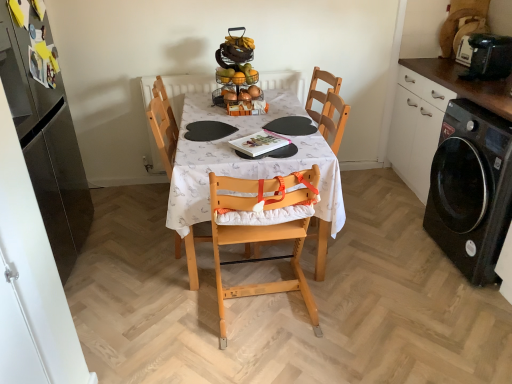
Where is `light wood highchair at center, which is the 1th chair in left-to-right order`? This screenshot has width=512, height=384. light wood highchair at center, which is the 1th chair in left-to-right order is located at coordinates (163, 130).

At what (x,y) coordinates should I click in order to perform the action: click on glossy stainless steel refrigerator at left, the 1th cabinetry viewed from the left. Please return your answer as a coordinate pair (x, y). Looking at the image, I should click on (46, 146).

This screenshot has height=384, width=512. Describe the element at coordinates (431, 115) in the screenshot. I see `black matte cabinet at right, which is counted as the 2th cabinetry, starting from the left` at that location.

What is the approximate height of black glossy washing machine at right?

black glossy washing machine at right is 33.84 inches tall.

What are the coordinates of `black plastic toaster at upper right` in the screenshot? It's located at (488, 56).

Considering the sizes of black matte cabinet at right, which is counted as the 2th cabinetry, starting from the left, and light wood highchair at center, which is the 1th chair in left-to-right order, in the image, is black matte cabinet at right, which is counted as the 2th cabinetry, starting from the left, taller or shorter than light wood highchair at center, which is the 1th chair in left-to-right order,?

Considering their sizes, black matte cabinet at right, which is counted as the 2th cabinetry, starting from the left, has less height than light wood highchair at center, which is the 1th chair in left-to-right order.

In terms of size, does black matte cabinet at right, which is counted as the 2th cabinetry, starting from the left, appear bigger or smaller than light wood highchair at center, which is counted as the 2th chair, starting from the right?

Considering their sizes, black matte cabinet at right, which is counted as the 2th cabinetry, starting from the left, takes up more space than light wood highchair at center, which is counted as the 2th chair, starting from the right.

Identify the location of kitchen appliance in front of the black plastic toaster at upper right. (471, 189).

Between black glossy washing machine at right and black plastic toaster at upper right, which one appears on the left side from the viewer's perspective?

black plastic toaster at upper right is more to the left.

Would you say black glossy washing machine at right is outside black plastic toaster at upper right?

Yes, black glossy washing machine at right is not within black plastic toaster at upper right.

Does black glossy washing machine at right have a lesser width compared to black plastic toaster at upper right?

In fact, black glossy washing machine at right might be wider than black plastic toaster at upper right.

Does light wood highchair at center, which is counted as the 2th chair, starting from the right, have a larger size compared to glossy stainless steel refrigerator at left, the 1th cabinetry viewed from the left?

Incorrect, light wood highchair at center, which is counted as the 2th chair, starting from the right, is not larger than glossy stainless steel refrigerator at left, the 1th cabinetry viewed from the left.

From a real-world perspective, between light wood highchair at center, which is counted as the 2th chair, starting from the right, and glossy stainless steel refrigerator at left, the 1th cabinetry viewed from the left, who is vertically higher?

glossy stainless steel refrigerator at left, the 1th cabinetry viewed from the left.

Considering the relative sizes of light wood highchair at center, which is counted as the 2th chair, starting from the right, and glossy stainless steel refrigerator at left, which appears as the second cabinetry when viewed from the right, in the image provided, is light wood highchair at center, which is counted as the 2th chair, starting from the right, shorter than glossy stainless steel refrigerator at left, which appears as the second cabinetry when viewed from the right,?

Yes, light wood highchair at center, which is counted as the 2th chair, starting from the right, is shorter than glossy stainless steel refrigerator at left, which appears as the second cabinetry when viewed from the right.

Where is `the 2nd cabinetry positioned above the light wood highchair at center, which is counted as the 2th chair, starting from the right (from the image's perspective)`? the 2nd cabinetry positioned above the light wood highchair at center, which is counted as the 2th chair, starting from the right (from the image's perspective) is located at coordinates (46, 146).

From the image's perspective, is glossy stainless steel refrigerator at left, which appears as the second cabinetry when viewed from the right, located above or below light wood highchair at center, which is the 1th chair in left-to-right order?

From the image's perspective, glossy stainless steel refrigerator at left, which appears as the second cabinetry when viewed from the right, appears above light wood highchair at center, which is the 1th chair in left-to-right order.

What's the angular difference between glossy stainless steel refrigerator at left, which appears as the second cabinetry when viewed from the right, and light wood highchair at center, which is the 1th chair in left-to-right order,'s facing directions?

6.94e-06 degrees.

From a real-world perspective, relative to light wood highchair at center, which is counted as the 2th chair, starting from the right, is glossy stainless steel refrigerator at left, which appears as the second cabinetry when viewed from the right, vertically above or below?

glossy stainless steel refrigerator at left, which appears as the second cabinetry when viewed from the right, is situated higher than light wood highchair at center, which is counted as the 2th chair, starting from the right, in the real world.

Is glossy stainless steel refrigerator at left, the 1th cabinetry viewed from the left, not near light wood highchair at center, which is counted as the 2th chair, starting from the right?

Actually, glossy stainless steel refrigerator at left, the 1th cabinetry viewed from the left, and light wood highchair at center, which is counted as the 2th chair, starting from the right, are a little close together.

Considering the sizes of objects black glossy washing machine at right and glossy stainless steel refrigerator at left, the 1th cabinetry viewed from the left, in the image provided, who is taller, black glossy washing machine at right or glossy stainless steel refrigerator at left, the 1th cabinetry viewed from the left,?

With more height is glossy stainless steel refrigerator at left, the 1th cabinetry viewed from the left.

How much distance is there between black glossy washing machine at right and glossy stainless steel refrigerator at left, which appears as the second cabinetry when viewed from the right?

The distance of black glossy washing machine at right from glossy stainless steel refrigerator at left, which appears as the second cabinetry when viewed from the right, is 7.47 feet.

Is black glossy washing machine at right inside the boundaries of glossy stainless steel refrigerator at left, which appears as the second cabinetry when viewed from the right, or outside?

black glossy washing machine at right cannot be found inside glossy stainless steel refrigerator at left, which appears as the second cabinetry when viewed from the right.

Considering the sizes of objects black glossy washing machine at right and glossy stainless steel refrigerator at left, which appears as the second cabinetry when viewed from the right, in the image provided, who is thinner, black glossy washing machine at right or glossy stainless steel refrigerator at left, which appears as the second cabinetry when viewed from the right,?

glossy stainless steel refrigerator at left, which appears as the second cabinetry when viewed from the right.

Consider the image. From a real-world perspective, which is physically below, light wood highchair at center, the first chair viewed from the right, or black matte cabinet at right, the first cabinetry from the right?

From a 3D spatial view, light wood highchair at center, the first chair viewed from the right, is below.

Does light wood highchair at center, the first chair viewed from the right, appear on the left side of black matte cabinet at right, the first cabinetry from the right?

Yes.

Is light wood highchair at center, which is the 2th chair in left-to-right order, in front of or behind black matte cabinet at right, which is counted as the 2th cabinetry, starting from the left, in the image?

light wood highchair at center, which is the 2th chair in left-to-right order, is positioned farther from the viewer than black matte cabinet at right, which is counted as the 2th cabinetry, starting from the left.

Is light wood highchair at center, the first chair viewed from the right, smaller than black matte cabinet at right, the first cabinetry from the right?

Correct, light wood highchair at center, the first chair viewed from the right, occupies less space than black matte cabinet at right, the first cabinetry from the right.

Consider the image. From the image's perspective, is white fabric table at center below light wood highchair at center, which is the 2th chair in left-to-right order?

No.

Can you tell me how much white fabric table at center and light wood highchair at center, the first chair viewed from the right, differ in facing direction?

The facing directions of white fabric table at center and light wood highchair at center, the first chair viewed from the right, are 180 degrees apart.

Considering the sizes of white fabric table at center and light wood highchair at center, which is the 2th chair in left-to-right order, in the image, is white fabric table at center wider or thinner than light wood highchair at center, which is the 2th chair in left-to-right order,?

Considering their sizes, white fabric table at center looks broader than light wood highchair at center, which is the 2th chair in left-to-right order.

Does white fabric table at center have a greater height compared to light wood highchair at center, the first chair viewed from the right?

Incorrect, the height of white fabric table at center is not larger of that of light wood highchair at center, the first chair viewed from the right.

This screenshot has width=512, height=384. What are the coordinates of `cabinetry lying on the right of light wood highchair at center, which is counted as the 2th chair, starting from the right` in the screenshot? It's located at (431, 115).

Identify the location of appliance above the black glossy washing machine at right (from the image's perspective). click(488, 56).

From the image, which object appears to be farther from black matte cabinet at right, which is counted as the 2th cabinetry, starting from the left, glossy stainless steel refrigerator at left, the 1th cabinetry viewed from the left, or black glossy washing machine at right?

glossy stainless steel refrigerator at left, the 1th cabinetry viewed from the left, is positioned further to the anchor black matte cabinet at right, which is counted as the 2th cabinetry, starting from the left.

Estimate the real-world distances between objects in this image. Which object is closer to black matte cabinet at right, the first cabinetry from the right, black plastic toaster at upper right or light wood highchair at center, which is counted as the 2th chair, starting from the right?

black plastic toaster at upper right.

Considering their positions, is white fabric table at center positioned further to black matte cabinet at right, the first cabinetry from the right, than glossy stainless steel refrigerator at left, the 1th cabinetry viewed from the left?

glossy stainless steel refrigerator at left, the 1th cabinetry viewed from the left.

Based on their spatial positions, is light wood highchair at center, which is the 2th chair in left-to-right order, or glossy stainless steel refrigerator at left, the 1th cabinetry viewed from the left, closer to light wood highchair at center, which is counted as the 2th chair, starting from the right?

light wood highchair at center, which is the 2th chair in left-to-right order, is positioned closer to the anchor light wood highchair at center, which is counted as the 2th chair, starting from the right.

Considering their positions, is light wood highchair at center, which is counted as the 2th chair, starting from the right, positioned further to white fabric table at center than black plastic toaster at upper right?

The object further to white fabric table at center is black plastic toaster at upper right.

Considering their positions, is glossy stainless steel refrigerator at left, which appears as the second cabinetry when viewed from the right, positioned closer to black glossy washing machine at right than white fabric table at center?

The object closer to black glossy washing machine at right is white fabric table at center.

Looking at the image, which one is located closer to black matte cabinet at right, which is counted as the 2th cabinetry, starting from the left, light wood highchair at center, the first chair viewed from the right, or black plastic toaster at upper right?

Among the two, black plastic toaster at upper right is located nearer to black matte cabinet at right, which is counted as the 2th cabinetry, starting from the left.

When comparing their distances from glossy stainless steel refrigerator at left, the 1th cabinetry viewed from the left, does light wood highchair at center, which is the 1th chair in left-to-right order, or white fabric table at center seem closer?

light wood highchair at center, which is the 1th chair in left-to-right order, is closer to glossy stainless steel refrigerator at left, the 1th cabinetry viewed from the left.

What are the coordinates of `chair situated between light wood highchair at center, which is counted as the 2th chair, starting from the right, and black plastic toaster at upper right from left to right` in the screenshot? It's located at (263, 232).

This screenshot has height=384, width=512. In order to click on chair located between glossy stainless steel refrigerator at left, the 1th cabinetry viewed from the left, and white fabric table at center in the left-right direction in this screenshot , I will do `click(163, 130)`.

Identify the location of chair situated between light wood highchair at center, which is counted as the 2th chair, starting from the right, and black glossy washing machine at right from left to right. (263, 232).

Image resolution: width=512 pixels, height=384 pixels. I want to click on appliance located between light wood highchair at center, the first chair viewed from the right, and black matte cabinet at right, which is counted as the 2th cabinetry, starting from the left, in the left-right direction, so click(x=488, y=56).